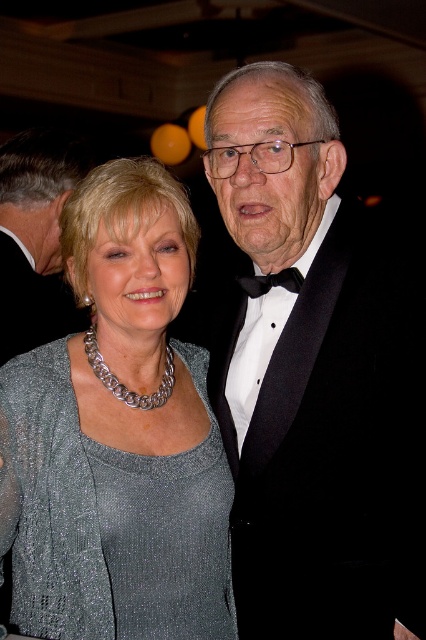
Question: Does black satin bow tie at upper right lie in front of black satin bow tie at center?

Choices:
 (A) no
 (B) yes

Answer: (A)

Question: Which of the following is the closest to the observer?

Choices:
 (A) (103, 385)
 (B) (8, 161)
 (C) (55, 547)
 (D) (268, 278)

Answer: (C)

Question: Which point appears farthest from the camera in this image?

Choices:
 (A) (103, 381)
 (B) (140, 292)

Answer: (A)

Question: Is sparkly silver dress at center closer to camera compared to black satin bow tie at center?

Choices:
 (A) yes
 (B) no

Answer: (A)

Question: Observing the image, what is the correct spatial positioning of black satin bow tie at upper right in reference to black satin bow tie at center?

Choices:
 (A) left
 (B) right

Answer: (A)

Question: Which point appears farthest from the camera in this image?

Choices:
 (A) (115, 397)
 (B) (72, 173)

Answer: (B)